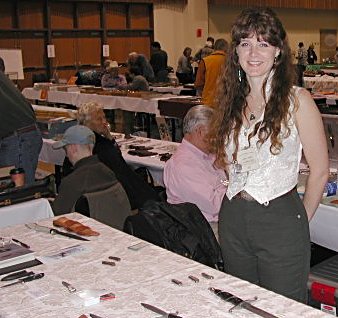
Where is `door`? door is located at coordinates (331, 42).